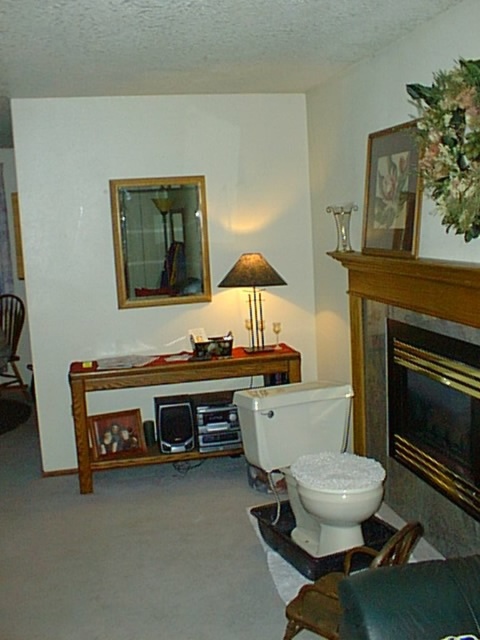
Is the position of white glossy toilet bowl at center less distant than that of wooden picture frame at center?

Yes, white glossy toilet bowl at center is closer to the viewer.

Is white glossy toilet bowl at center to the left of wooden picture frame at center from the viewer's perspective?

Incorrect, white glossy toilet bowl at center is not on the left side of wooden picture frame at center.

This screenshot has height=640, width=480. In order to click on white glossy toilet bowl at center in this screenshot , I will do `click(305, 456)`.

Based on the photo, is wooden armchair at lower right to the left of matte black lampshade at center from the viewer's perspective?

No, wooden armchair at lower right is not to the left of matte black lampshade at center.

Can you confirm if wooden armchair at lower right is wider than matte black lampshade at center?

Indeed, wooden armchair at lower right has a greater width compared to matte black lampshade at center.

Describe the element at coordinates (337, 586) in the screenshot. I see `wooden armchair at lower right` at that location.

You are a GUI agent. You are given a task and a screenshot of the screen. Output one action in this format:
    pyautogui.click(x=<x>, y=<y>)
    Task: Click on the wooden armchair at lower right
    The image size is (480, 640).
    Given the screenshot: What is the action you would take?
    pyautogui.click(x=337, y=586)

Does wooden picture frame at center have a greater height compared to wooden armchair at left?

Incorrect, wooden picture frame at center's height is not larger of wooden armchair at left's.

Can you confirm if wooden picture frame at center is positioned below wooden armchair at left?

Indeed, wooden picture frame at center is positioned under wooden armchair at left.

You are a GUI agent. You are given a task and a screenshot of the screen. Output one action in this format:
    pyautogui.click(x=<x>, y=<y>)
    Task: Click on the wooden picture frame at center
    Image resolution: width=480 pixels, height=640 pixels.
    Given the screenshot: What is the action you would take?
    pyautogui.click(x=116, y=435)